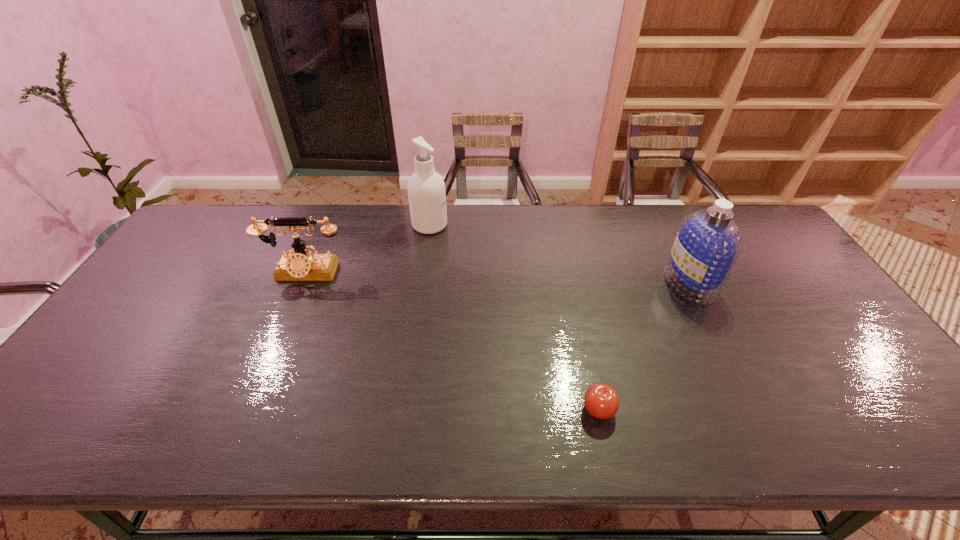
What are the coordinates of `free space located 0.170m on the dial of the leftmost object` in the screenshot? It's located at (281, 329).

Image resolution: width=960 pixels, height=540 pixels. I want to click on vacant space located 0.380m on the left of the second object from right to left, so click(x=417, y=409).

Image resolution: width=960 pixels, height=540 pixels. I want to click on object that is at the far edge, so click(x=426, y=190).

Locate an element on the screen. This screenshot has width=960, height=540. object that is at the near edge is located at coordinates (601, 400).

The width and height of the screenshot is (960, 540). I want to click on vacant space at the far edge, so click(x=462, y=213).

In the image, there is a desktop. At what (x,y) coordinates should I click in order to perform the action: click on vacant space at the near edge. Please return your answer as a coordinate pair (x, y). The image size is (960, 540). Looking at the image, I should click on (373, 447).

I want to click on vacant space at the left edge, so click(x=188, y=254).

In the image, there is a desktop. Identify the location of vacant space at the right edge. The height and width of the screenshot is (540, 960). (823, 373).

Locate an element on the screen. vacant space at the near right corner of the desktop is located at coordinates (880, 448).

Locate an element on the screen. The width and height of the screenshot is (960, 540). vacant area between the shortest object and the second object from left to right is located at coordinates (515, 317).